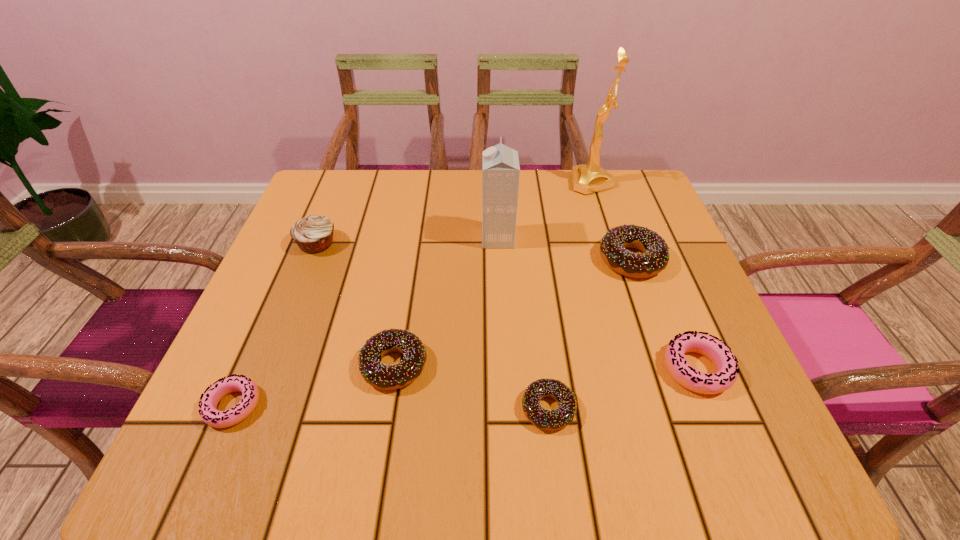
I want to click on doughnut that is the second closest to the third doughnut from left to right, so click(x=720, y=354).

Select which chocolate doughnut appears as the second closest to the right pink doughnut. Please provide its 2D coordinates. Your answer should be formatted as a tuple, i.e. [(x, y)], where the tuple contains the x and y coordinates of a point satisfying the conditions above.

[(563, 415)]

Identify which chocolate doughnut is the nearest to the third tallest object. Please provide its 2D coordinates. Your answer should be formatted as a tuple, i.e. [(x, y)], where the tuple contains the x and y coordinates of a point satisfying the conditions above.

[(387, 377)]

You are a GUI agent. You are given a task and a screenshot of the screen. Output one action in this format:
    pyautogui.click(x=<x>, y=<y>)
    Task: Click on the vacant area that satisfies the following two spatial constraints: 1. on the front label of the second tallest object; 2. on the left side of the rightmost chocolate doughnut
    This screenshot has width=960, height=540.
    Given the screenshot: What is the action you would take?
    [499, 259]

Find the location of `vacant space that satisfies the following two spatial constraints: 1. on the back side of the third doughnut from right to left; 2. on the left side of the farthest chocolate doughnut`. vacant space that satisfies the following two spatial constraints: 1. on the back side of the third doughnut from right to left; 2. on the left side of the farthest chocolate doughnut is located at coordinates (530, 259).

Locate an element on the screen. vacant position in the image that satisfies the following two spatial constraints: 1. on the back side of the smaller pink doughnut; 2. on the right side of the tallest doughnut is located at coordinates (297, 259).

Where is `vacant space that satisfies the following two spatial constraints: 1. on the back side of the second chocolate doughnut from left to right; 2. on the front label of the carton`? vacant space that satisfies the following two spatial constraints: 1. on the back side of the second chocolate doughnut from left to right; 2. on the front label of the carton is located at coordinates (528, 238).